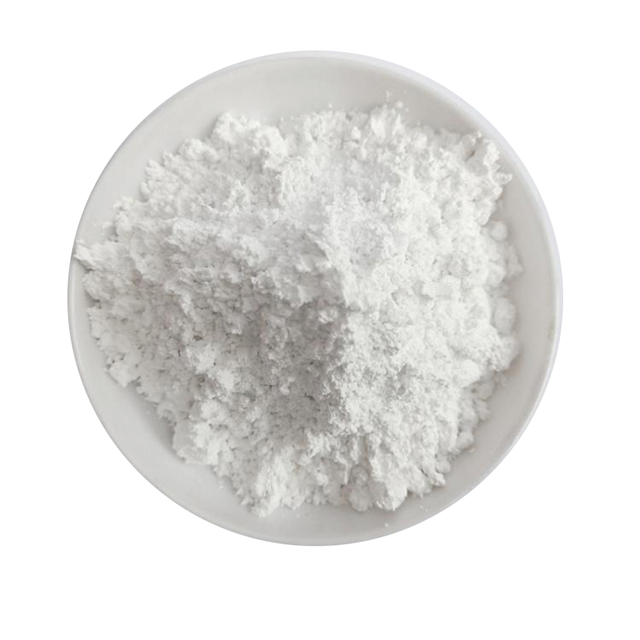
You are a GUI agent. You are given a task and a screenshot of the screen. Output one action in this format:
    pyautogui.click(x=<x>, y=<y>)
    Task: Click on the inside top of bowl
    
    Given the screenshot: What is the action you would take?
    pyautogui.click(x=323, y=86)